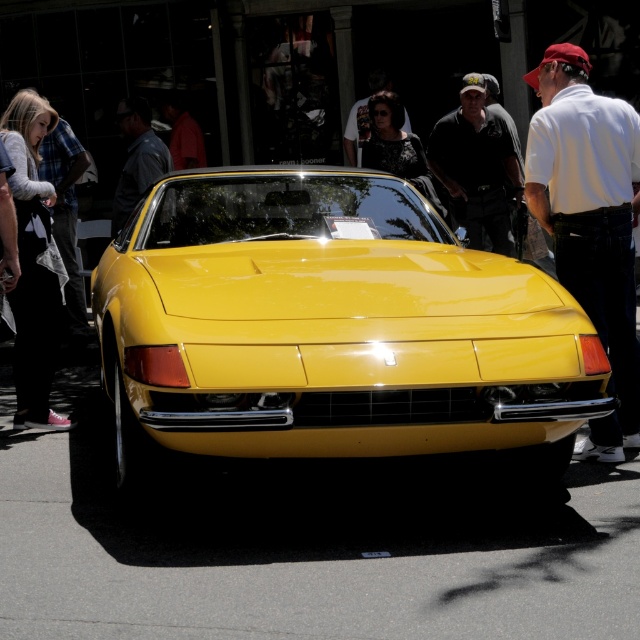
You are a photographer trying to capture both the glossy yellow car at center and the white cotton shirt at center in a single frame. Given that your camera has a fixed focal length, which object should you position closer to ensure both fit within the frame?

Since the glossy yellow car at center is wider than the white cotton shirt at center, you should position the glossy yellow car at center closer to the camera to ensure both fit within the frame.

You are standing in front of the yellow sports car and notice a specific point on the image. Can you tell me what object the point at coordinates (589, 220) is located on?

The point at coordinates (589, 220) is located on the white cotton shirt at center.

You are standing 5 meters away from the yellow sports car. A point on the car at coordinates point is at point (257, 216). Is this point closer to you than the front grille?

The distance of point (257, 216) from viewer is 5.53 meters, which is farther than your current position of 5 meters away from the car. Therefore, the point is not closer to you than the front grille.